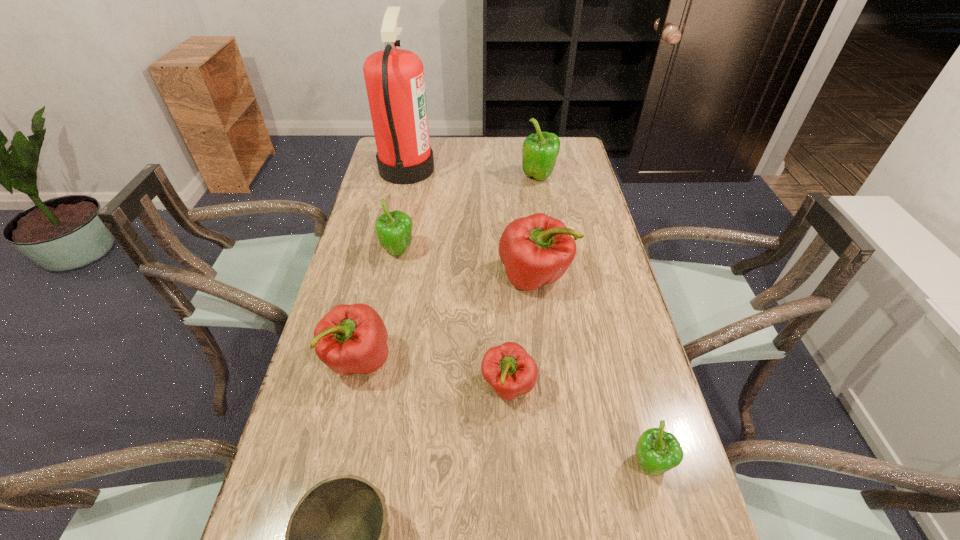
Point out which object is positioned as the nearest to the biggest pink bell pepper. Please provide its 2D coordinates. Your answer should be formatted as a tuple, i.e. [(x, y)], where the tuple contains the x and y coordinates of a point satisfying the conditions above.

[(510, 371)]

You are a GUI agent. You are given a task and a screenshot of the screen. Output one action in this format:
    pyautogui.click(x=<x>, y=<y>)
    Task: Click on the object identified as the sixth closest to the farthest green bell pepper
    
    Given the screenshot: What is the action you would take?
    pyautogui.click(x=657, y=451)

Where is `the closest bell pepper to the bowl`? Image resolution: width=960 pixels, height=540 pixels. the closest bell pepper to the bowl is located at coordinates (510, 371).

Select which bell pepper appears as the second closest to the red fire extinguisher. Please provide its 2D coordinates. Your answer should be formatted as a tuple, i.e. [(x, y)], where the tuple contains the x and y coordinates of a point satisfying the conditions above.

[(540, 150)]

Identify which green bell pepper is the second closest to the fire extinguisher. Please provide its 2D coordinates. Your answer should be formatted as a tuple, i.e. [(x, y)], where the tuple contains the x and y coordinates of a point satisfying the conditions above.

[(540, 150)]

Where is `green bell pepper that is the second nearest to the fire extinguisher`? This screenshot has width=960, height=540. green bell pepper that is the second nearest to the fire extinguisher is located at coordinates (540, 150).

Where is `pink bell pepper identified as the second closest to the smallest pink bell pepper`? The image size is (960, 540). pink bell pepper identified as the second closest to the smallest pink bell pepper is located at coordinates (351, 339).

Locate an element on the screen. The height and width of the screenshot is (540, 960). pink bell pepper that can be found as the second closest to the smallest pink bell pepper is located at coordinates (351, 339).

The width and height of the screenshot is (960, 540). I want to click on vacant point that satisfies the following two spatial constraints: 1. on the front side of the rightmost green bell pepper; 2. on the right side of the leftmost green bell pepper, so click(x=356, y=465).

The height and width of the screenshot is (540, 960). I want to click on blank space that satisfies the following two spatial constraints: 1. on the front side of the second smallest pink bell pepper; 2. on the right side of the smallest pink bell pepper, so click(352, 387).